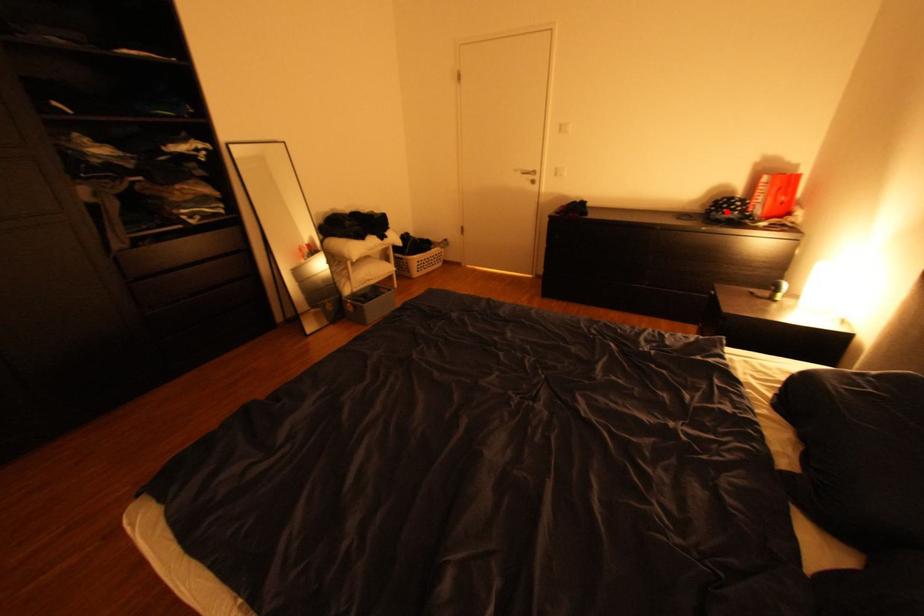
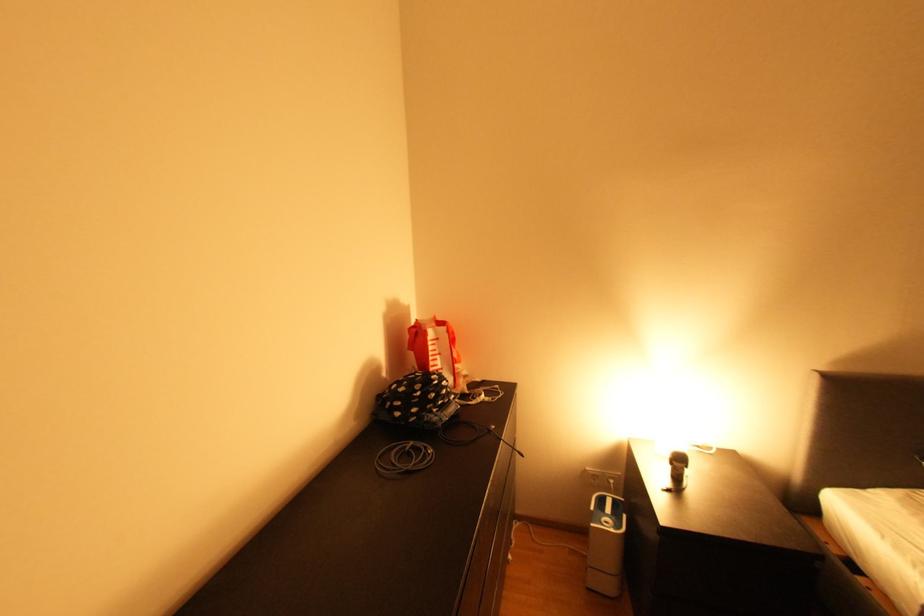
Find the pixel in the second image that matches the highlighted location in the first image.

(441, 411)